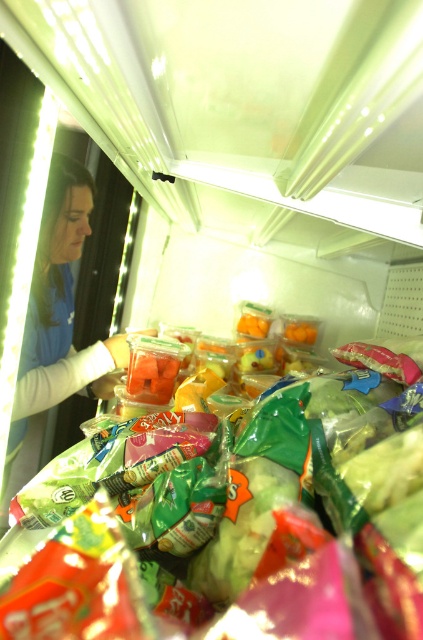
Is translucent plastic bag of chips at center taller than blue fabric woman at left?

In fact, translucent plastic bag of chips at center may be shorter than blue fabric woman at left.

Find the location of `translucent plastic bag of chips at center`. translucent plastic bag of chips at center is located at coordinates (241, 528).